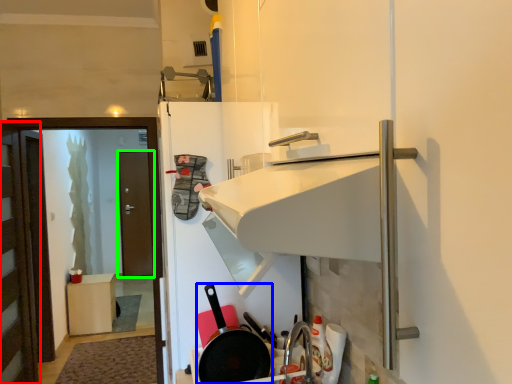
Question: Which is nearer to the door (highlighted by a red box)? frying pan (highlighted by a blue box) or door (highlighted by a green box).

Choices:
 (A) frying pan
 (B) door

Answer: (A)